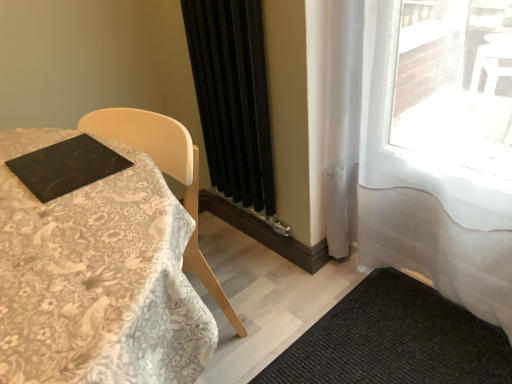
Question: Considering the relative positions of white lace tablecloth at left and black textured mat at lower right in the image provided, is white lace tablecloth at left to the right of black textured mat at lower right from the viewer's perspective?

Choices:
 (A) no
 (B) yes

Answer: (A)

Question: Is white lace tablecloth at left directly adjacent to black textured mat at lower right?

Choices:
 (A) no
 (B) yes

Answer: (A)

Question: Is white lace tablecloth at left smaller than black textured mat at lower right?

Choices:
 (A) no
 (B) yes

Answer: (A)

Question: From a real-world perspective, is white lace tablecloth at left located beneath black textured mat at lower right?

Choices:
 (A) no
 (B) yes

Answer: (A)

Question: Considering the relative positions of white lace tablecloth at left and black textured mat at lower right in the image provided, is white lace tablecloth at left to the left of black textured mat at lower right from the viewer's perspective?

Choices:
 (A) yes
 (B) no

Answer: (A)

Question: Considering the relative sizes of white lace tablecloth at left and black textured mat at lower right in the image provided, is white lace tablecloth at left thinner than black textured mat at lower right?

Choices:
 (A) no
 (B) yes

Answer: (B)

Question: Does black textured mat at lower right have a greater height compared to black matte curtain at center, placed as the 1th curtain when sorted from left to right?

Choices:
 (A) no
 (B) yes

Answer: (A)

Question: From the image's perspective, is black textured mat at lower right on top of black matte curtain at center, placed as the 1th curtain when sorted from left to right?

Choices:
 (A) no
 (B) yes

Answer: (A)

Question: Is black textured mat at lower right to the right of black matte curtain at center, the 2th curtain in the right-to-left sequence, from the viewer's perspective?

Choices:
 (A) yes
 (B) no

Answer: (A)

Question: Does black textured mat at lower right have a larger size compared to black matte curtain at center, the 2th curtain in the right-to-left sequence?

Choices:
 (A) no
 (B) yes

Answer: (A)

Question: Does black textured mat at lower right come in front of black matte curtain at center, the 2th curtain in the right-to-left sequence?

Choices:
 (A) no
 (B) yes

Answer: (B)

Question: From a real-world perspective, does black textured mat at lower right stand above black matte curtain at center, placed as the 1th curtain when sorted from left to right?

Choices:
 (A) no
 (B) yes

Answer: (A)

Question: Considering the relative sizes of black textured mat at lower right and white sheer curtain at right, which is counted as the 2th curtain, starting from the left, in the image provided, is black textured mat at lower right smaller than white sheer curtain at right, which is counted as the 2th curtain, starting from the left,?

Choices:
 (A) yes
 (B) no

Answer: (A)